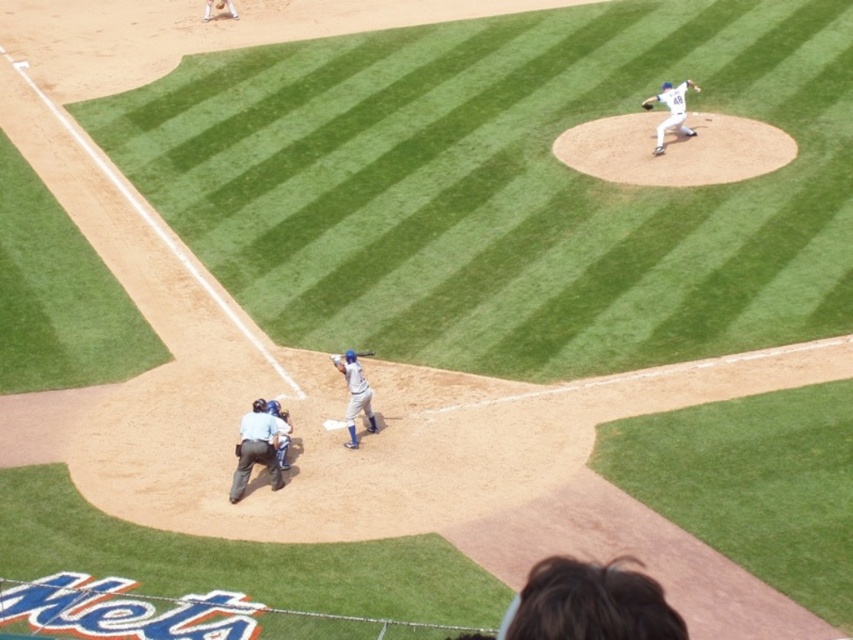
Question: Can you confirm if white matte baseball pitcher at upper right is positioned to the left of matte blue bat at center?

Choices:
 (A) no
 (B) yes

Answer: (A)

Question: In this image, where is blue uniform bat at center located relative to dark brown leather glove at upper right?

Choices:
 (A) below
 (B) above

Answer: (A)

Question: Which is farther from the matte blue bat at center?

Choices:
 (A) blue fabric catcher at lower center
 (B) dark brown leather glove at upper right
 (C) white matte baseball pitcher at upper right

Answer: (B)

Question: Which is farther from the matte blue bat at center?

Choices:
 (A) white matte baseball pitcher at upper right
 (B) light blue uniform at center
 (C) blue uniform bat at center

Answer: (A)

Question: Which is nearer to the dark brown leather glove at upper right?

Choices:
 (A) white matte baseball pitcher at upper right
 (B) blue fabric catcher at lower center
 (C) light blue uniform at center
 (D) matte blue bat at center

Answer: (A)

Question: Observing the image, what is the correct spatial positioning of white matte baseball pitcher at upper right in reference to matte blue bat at center?

Choices:
 (A) right
 (B) left

Answer: (A)